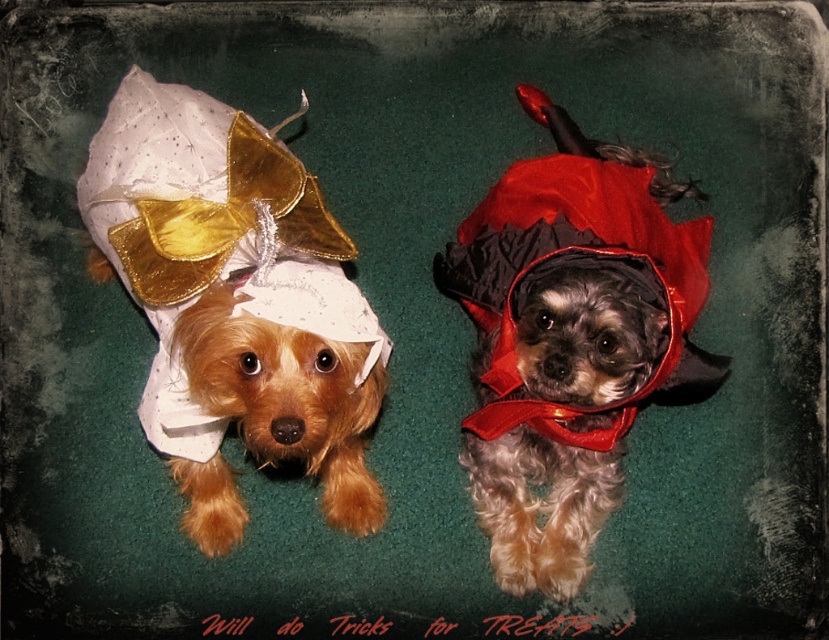
Question: Can you confirm if shiny white dress at upper left is positioned above velvet red cape at center?

Choices:
 (A) yes
 (B) no

Answer: (B)

Question: Can you confirm if shiny white dress at upper left is positioned above velvet red cape at center?

Choices:
 (A) no
 (B) yes

Answer: (A)

Question: Does shiny white dress at upper left appear on the right side of velvet red cape at center?

Choices:
 (A) yes
 (B) no

Answer: (B)

Question: Which of the following is the farthest from the observer?

Choices:
 (A) velvet red cape at center
 (B) shiny white dress at upper left

Answer: (A)